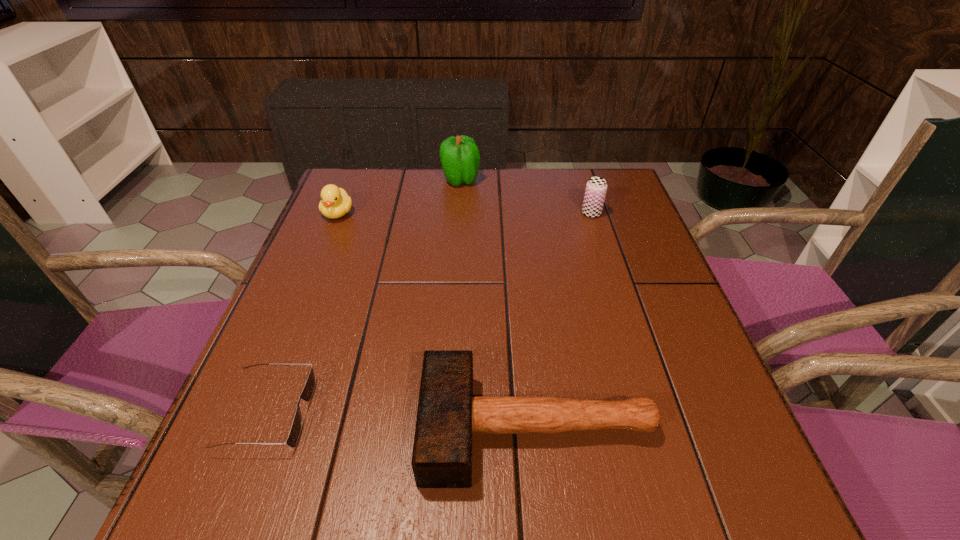
Where is `free point located on the hammer head face of the mallet`? The image size is (960, 540). free point located on the hammer head face of the mallet is located at coordinates (380, 428).

In order to click on free point located 0.210m on the hammer head face of the mallet in this screenshot , I will do coord(296,428).

Find the location of a particular element. The width and height of the screenshot is (960, 540). free space located 0.110m on the front-facing side of the sunglasses is located at coordinates (372, 413).

Find the location of `bell pepper situated at the far edge`. bell pepper situated at the far edge is located at coordinates (460, 157).

The width and height of the screenshot is (960, 540). Identify the location of beer can located in the far edge section of the desktop. pos(596,187).

Locate an element on the screen. duckling present at the far edge is located at coordinates click(335, 202).

Identify the location of object that is positioned at the near edge. The height and width of the screenshot is (540, 960). (448, 414).

Locate an element on the screen. duckling that is at the left edge is located at coordinates (335, 202).

At what (x,y) coordinates should I click in order to perform the action: click on sunglasses present at the left edge. Please return your answer as a coordinate pair (x, y). This screenshot has width=960, height=540. Looking at the image, I should click on pos(306,395).

Locate an element on the screen. beer can situated at the right edge is located at coordinates (596, 187).